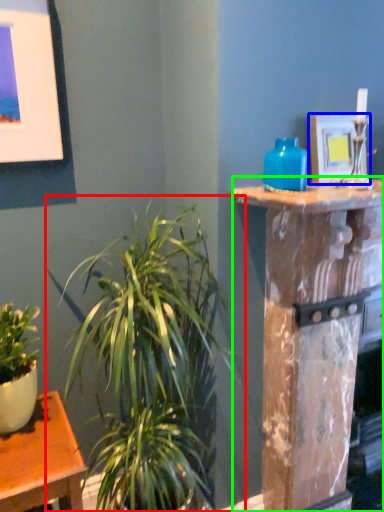
Question: Considering the real-world distances, which object is closest to houseplant (highlighted by a red box)? picture frame (highlighted by a blue box) or pillar (highlighted by a green box).

Choices:
 (A) picture frame
 (B) pillar

Answer: (B)